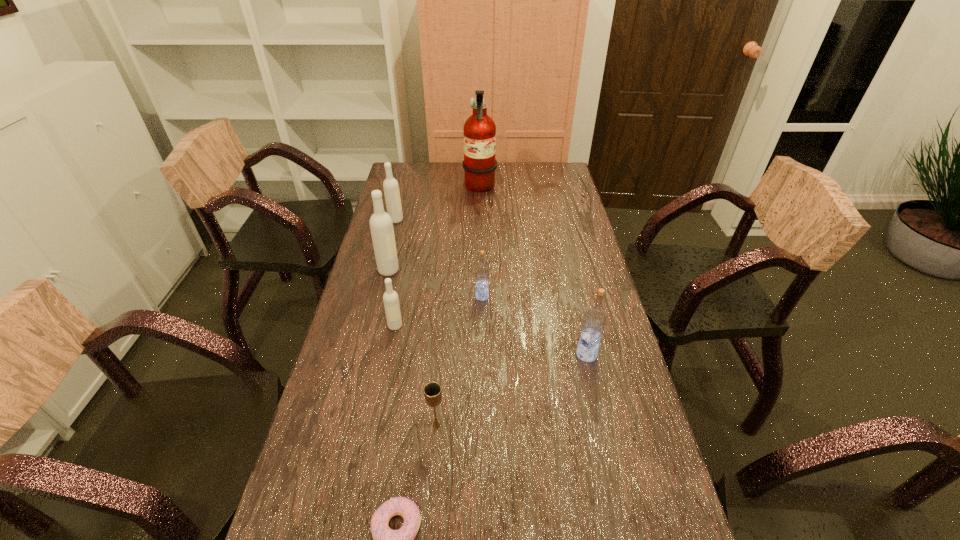
Locate an element on the screen. The height and width of the screenshot is (540, 960). vacant point located between the second shortest object and the left blue vodka is located at coordinates (459, 361).

Locate an element on the screen. This screenshot has height=540, width=960. empty space between the seventh tallest object and the tallest vodka is located at coordinates (413, 348).

Where is `object that is the sixth closest to the smaller blue vodka`? object that is the sixth closest to the smaller blue vodka is located at coordinates (479, 164).

Locate an element on the screen. The width and height of the screenshot is (960, 540). the third closest object to the chalice is located at coordinates (594, 320).

Select which vodka appears as the fourth closest to the doughnut. Please provide its 2D coordinates. Your answer should be formatted as a tuple, i.e. [(x, y)], where the tuple contains the x and y coordinates of a point satisfying the conditions above.

[(381, 225)]

Select which vodka appears as the second closest to the farthest vodka. Please provide its 2D coordinates. Your answer should be formatted as a tuple, i.e. [(x, y)], where the tuple contains the x and y coordinates of a point satisfying the conditions above.

[(482, 272)]

Identify which white vodka is the third closest to the fire extinguisher. Please provide its 2D coordinates. Your answer should be formatted as a tuple, i.e. [(x, y)], where the tuple contains the x and y coordinates of a point satisfying the conditions above.

[(390, 298)]

Identify which white vodka is the second nearest to the third nearest object. Please provide its 2D coordinates. Your answer should be formatted as a tuple, i.e. [(x, y)], where the tuple contains the x and y coordinates of a point satisfying the conditions above.

[(381, 225)]

The image size is (960, 540). Identify the location of blank space that satisfies the following two spatial constraints: 1. on the back side of the sixth farthest object; 2. on the left side of the second shortest object. click(x=443, y=354).